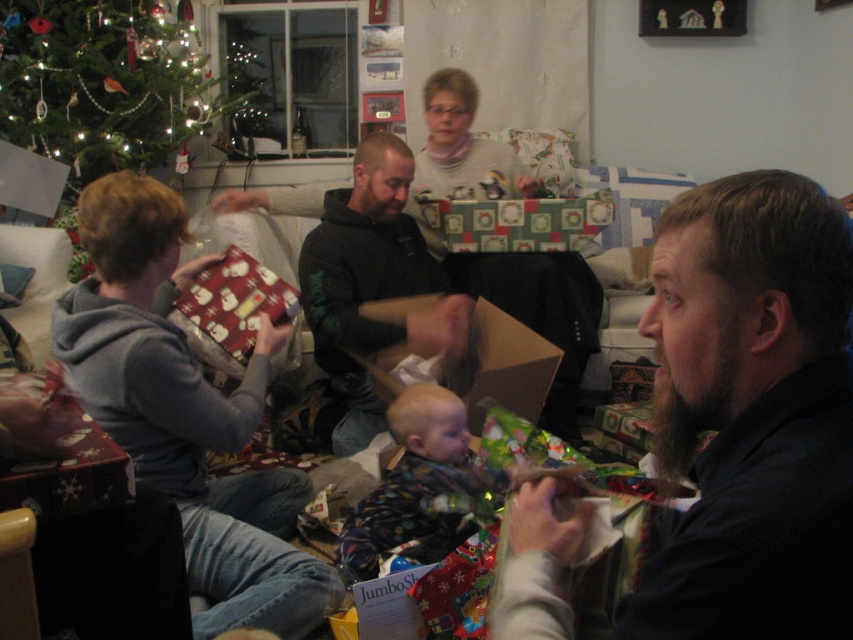
From the picture: You are planning to place a new decorative item on the shelf next to the matte gray hoodie at left and the green matte christmas tree at upper left. Which object should you consider the width of to ensure the shelf is wide enough?

You should consider the width of the green matte christmas tree at upper left because it is wider than the matte gray hoodie at left, so the shelf must accommodate its width.

You are a guest at the holiday gathering and want to compare the sizes of the items you see. Which is larger between the matte gray hoodie at left and the green matte christmas tree at upper left?

The green matte christmas tree at upper left is larger than the matte gray hoodie at left.

You are organizing a coat rack for guests at a holiday party. You have two coats to hang on the rack. The dark brown leather jacket at center and the black soft hoodie at center. Which coat should you hang lower on the rack to accommodate their sizes?

The dark brown leather jacket at center should be hung lower on the rack since it has a lesser height compared to the black soft hoodie at center, allowing both coats to fit properly on the rack.